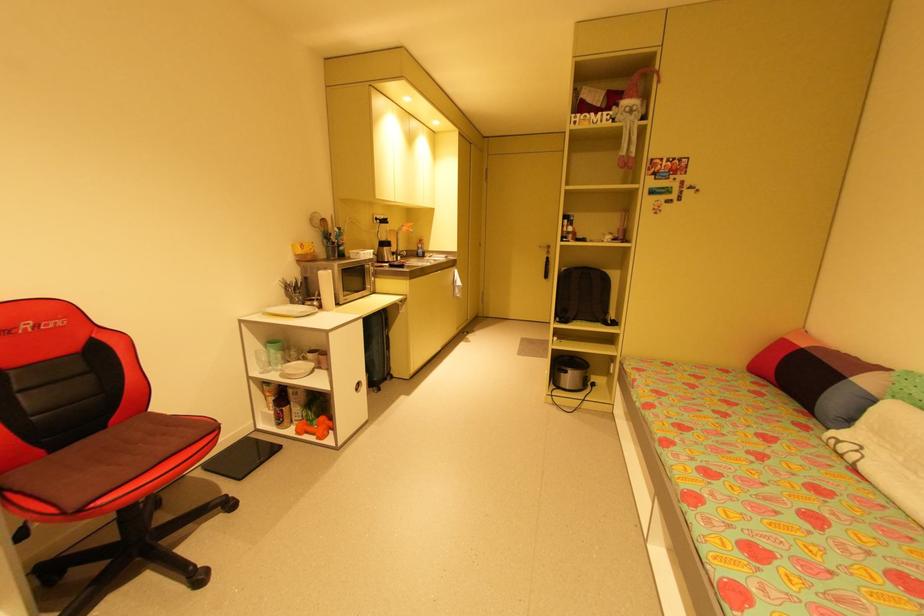
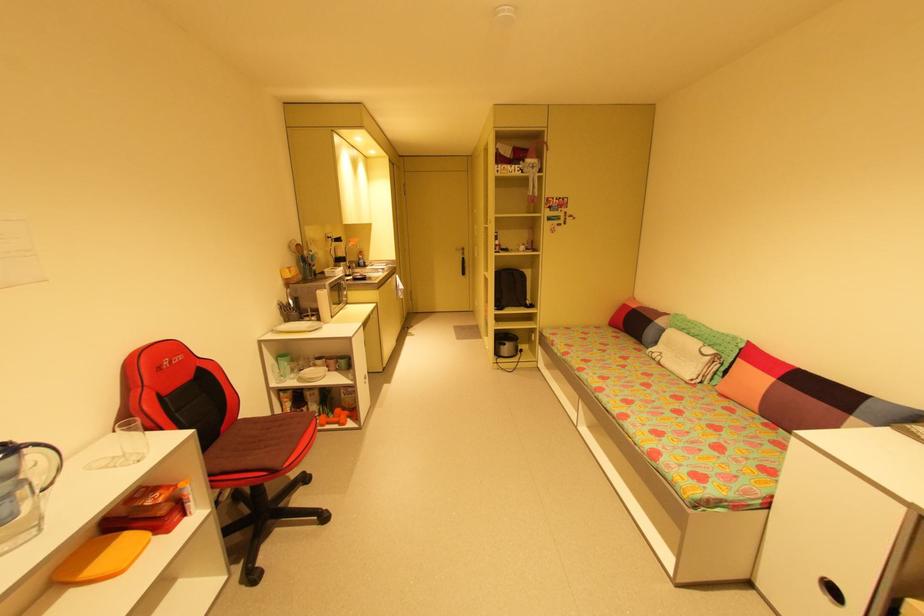
The point at (566, 374) is marked in the first image. Where is the corresponding point in the second image?

(505, 347)